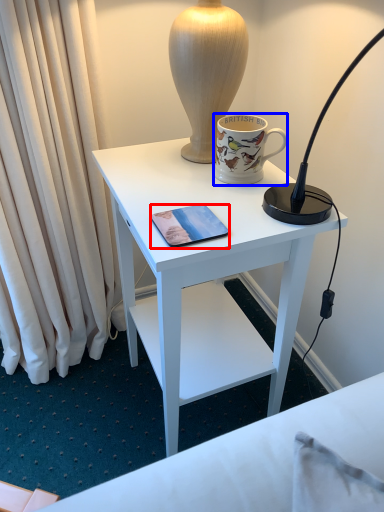
Question: Which object is closer to the camera taking this photo, mobile phone (highlighted by a red box) or coffee cup (highlighted by a blue box)?

Choices:
 (A) mobile phone
 (B) coffee cup

Answer: (A)